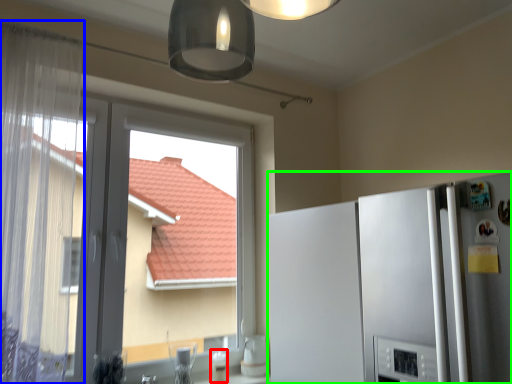
Question: Based on their relative distances, which object is nearer to appliance (highlighted by a red box)? Choose from curtain (highlighted by a blue box) and refrigerator (highlighted by a green box).

Choices:
 (A) curtain
 (B) refrigerator

Answer: (B)